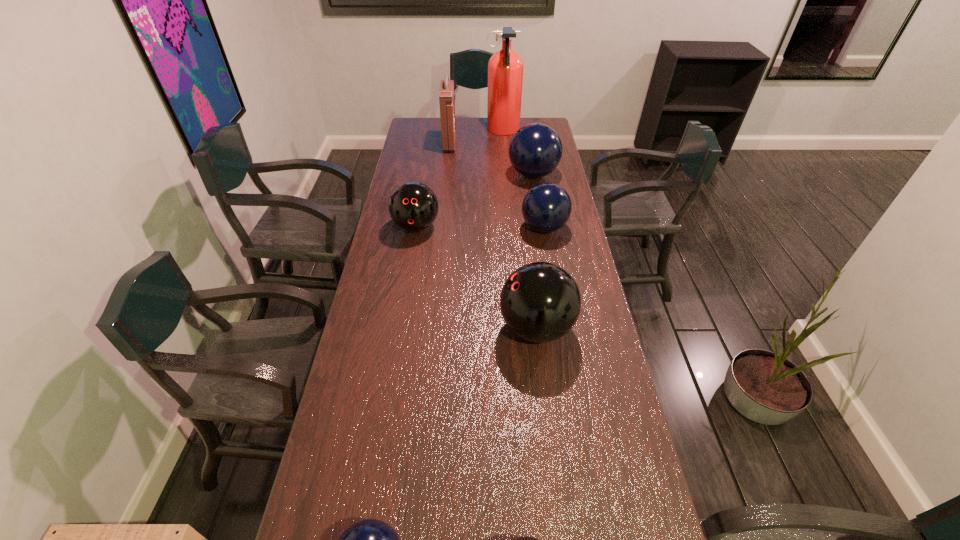
Locate an element on the screen. free region located on the surface of the second biggest blue bowling ball near the finger holes is located at coordinates (452, 228).

You are a GUI agent. You are given a task and a screenshot of the screen. Output one action in this format:
    pyautogui.click(x=<x>, y=<y>)
    Task: Click on the vacant area situated on the surface of the second biggest blue bowling ball near the finger holes
    
    Given the screenshot: What is the action you would take?
    pyautogui.click(x=455, y=228)

What are the coordinates of `object situated at the far edge` in the screenshot? It's located at (505, 68).

This screenshot has width=960, height=540. In order to click on object present at the left edge in this screenshot , I will do `click(413, 206)`.

The image size is (960, 540). I want to click on free space at the far edge, so click(462, 121).

The width and height of the screenshot is (960, 540). In the image, there is a desktop. What are the coordinates of `free space at the left edge` in the screenshot? It's located at (405, 233).

The image size is (960, 540). In order to click on vacant region at the right edge of the desktop in this screenshot , I will do `click(576, 269)`.

In order to click on vacant space at the far left corner in this screenshot , I will do `click(419, 132)`.

At what (x,y) coordinates should I click in order to perform the action: click on vacant space in between the second biggest blue bowling ball and the tallest object. Please return your answer as a coordinate pair (x, y). The width and height of the screenshot is (960, 540). Looking at the image, I should click on (523, 179).

I want to click on vacant space that is in between the red first-aid kit and the farthest blue bowling ball, so click(492, 160).